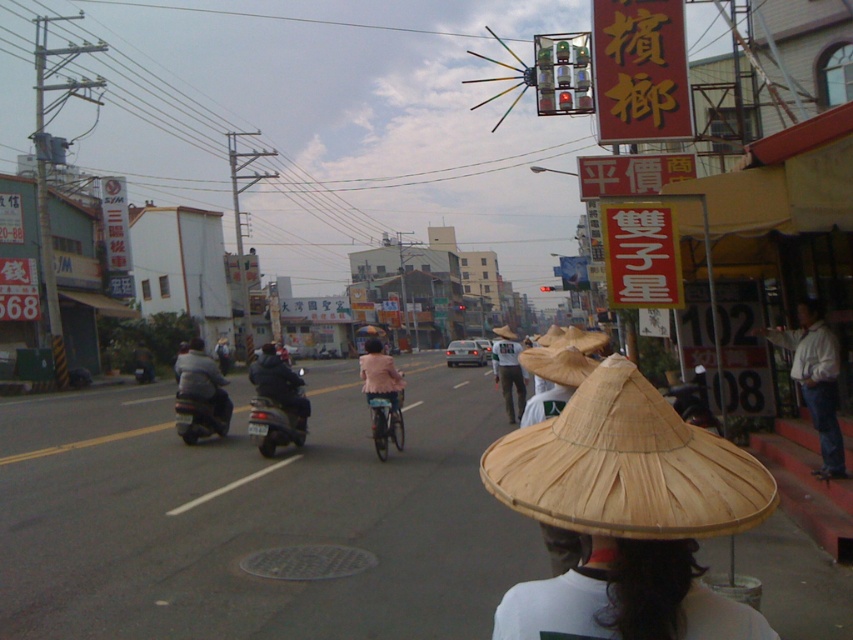
You are standing at the entrance of the betel nut shop and want to find the white straw hat at lower center. According to the coordinates provided, in which direction should you look relative to your current position?

The white straw hat at lower center is located at coordinates 0.938 on the x axis and 0.736 on the y axis. Since the x coordinate is closer to 1, it means the hat is to the right side of the image. The y coordinate is also relatively high, indicating it is towards the bottom of the image. Therefore, you should look towards the lower right direction from your current position at the betel nut shop entrance.

You are standing at the point labeled point (500, 376) and want to walk to the point labeled point (809, 369). Which direction should you move to get closer to your destination?

You should move forward because point (809, 369) is closer to the camera than point (500, 376), meaning it is in front of your current position.